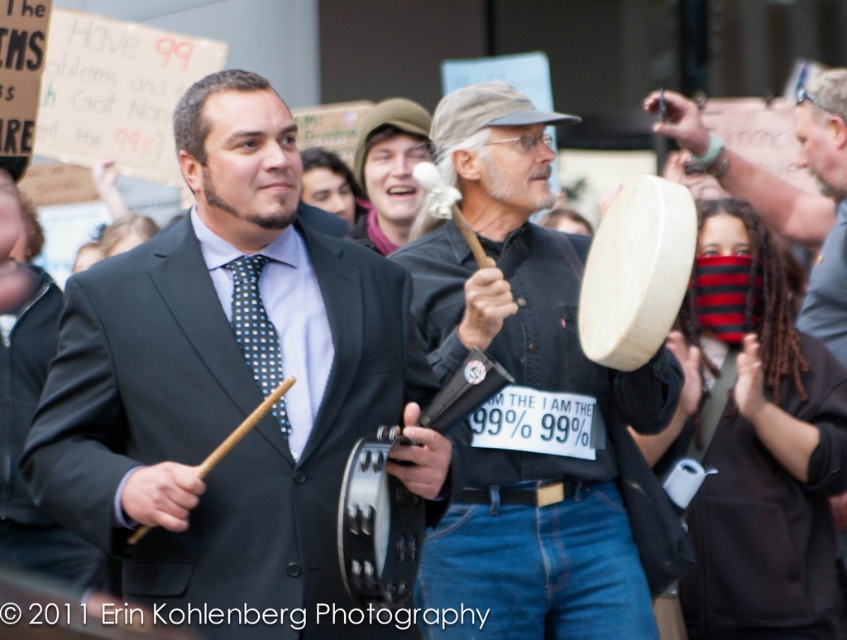
Question: Which point appears closest to the camera in this image?

Choices:
 (A) (690, 112)
 (B) (645, 348)
 (C) (357, 131)

Answer: (B)

Question: Can you confirm if wooden drum at center is smaller than black metallic tambourine at center?

Choices:
 (A) yes
 (B) no

Answer: (B)

Question: Can you confirm if white wooden drum at center is wider than blue dotted fabric tie at center?

Choices:
 (A) no
 (B) yes

Answer: (B)

Question: Is wooden tambourine at center above black metallic tambourine at center?

Choices:
 (A) no
 (B) yes

Answer: (B)

Question: Which of the following is the farthest from the observer?

Choices:
 (A) (246, 259)
 (B) (643, 307)

Answer: (A)

Question: Which object appears farthest from the camera in this image?

Choices:
 (A) black metallic tambourine at center
 (B) green fabric hat at center
 (C) matte black suit at center
 (D) wooden tambourine at center

Answer: (B)